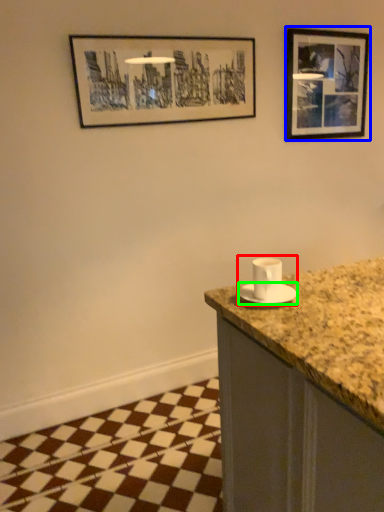
Question: Based on their relative distances, which object is nearer to sink (highlighted by a red box)? Choose from picture frame (highlighted by a blue box) and saucer (highlighted by a green box).

Choices:
 (A) picture frame
 (B) saucer

Answer: (B)